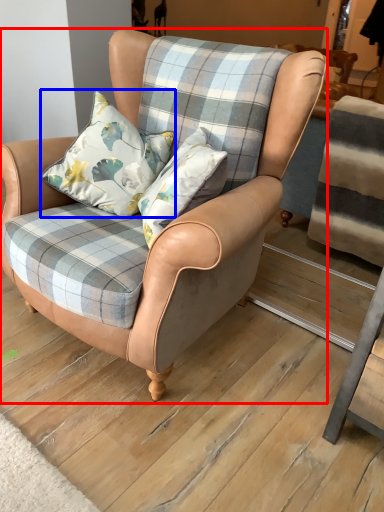
Question: Which of the following is the closest to the observer, chair (highlighted by a red box) or pillow (highlighted by a blue box)?

Choices:
 (A) chair
 (B) pillow

Answer: (A)